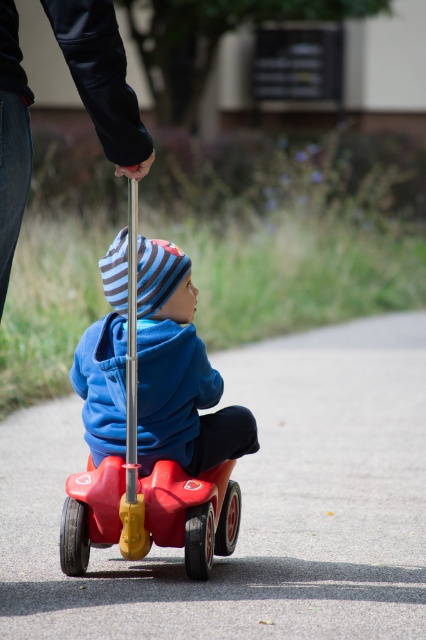
Question: Can you confirm if matte blue hoodie at center is bigger than black leather jacket at upper left?

Choices:
 (A) yes
 (B) no

Answer: (A)

Question: Which point is farther to the camera?

Choices:
 (A) (154, 248)
 (B) (94, 100)
 (C) (216, 552)

Answer: (C)

Question: Can you confirm if matte blue hoodie at center is wider than black leather jacket at upper left?

Choices:
 (A) no
 (B) yes

Answer: (B)

Question: Estimate the real-world distances between objects in this image. Which object is closer to the black leather jacket at upper left?

Choices:
 (A) rubberized plastic toy car at center
 (B) matte blue hoodie at center

Answer: (B)

Question: Which point is farther to the camera?

Choices:
 (A) matte blue hoodie at center
 (B) black leather jacket at upper left
 (C) rubberized plastic toy car at center

Answer: (C)

Question: Is black leather jacket at upper left to the left of rubberized plastic toy car at center from the viewer's perspective?

Choices:
 (A) yes
 (B) no

Answer: (A)